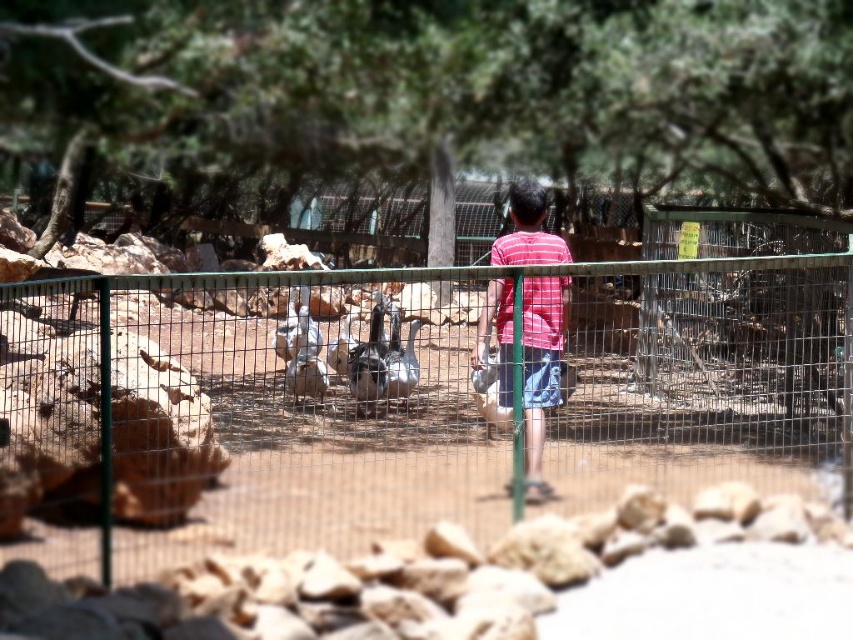
You are a zookeeper trying to determine if you can fit a new sign between the green wire mesh fence at center and the striped cotton shirt at center. Based on their widths, can you place the sign there?

The green wire mesh fence at center might be wider than striped cotton shirt at center, so it is uncertain if the sign can fit. Measure the space between them first.

You are a zookeeper trying to count the animals in the enclosure. You notice the green wire mesh fence at center and the striped cotton shirt at center. Which object is closer to you, the observer?

The green wire mesh fence at center is closer to you than the striped cotton shirt at center because it is positioned in front of it.